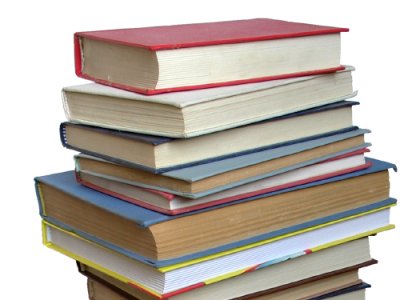
In order to click on books in a stack in this screenshot , I will do `click(176, 69)`, `click(160, 117)`, `click(173, 154)`, `click(194, 175)`, `click(174, 201)`, `click(185, 236)`, `click(199, 272)`, `click(266, 279)`, `click(297, 288)`, `click(349, 298)`.